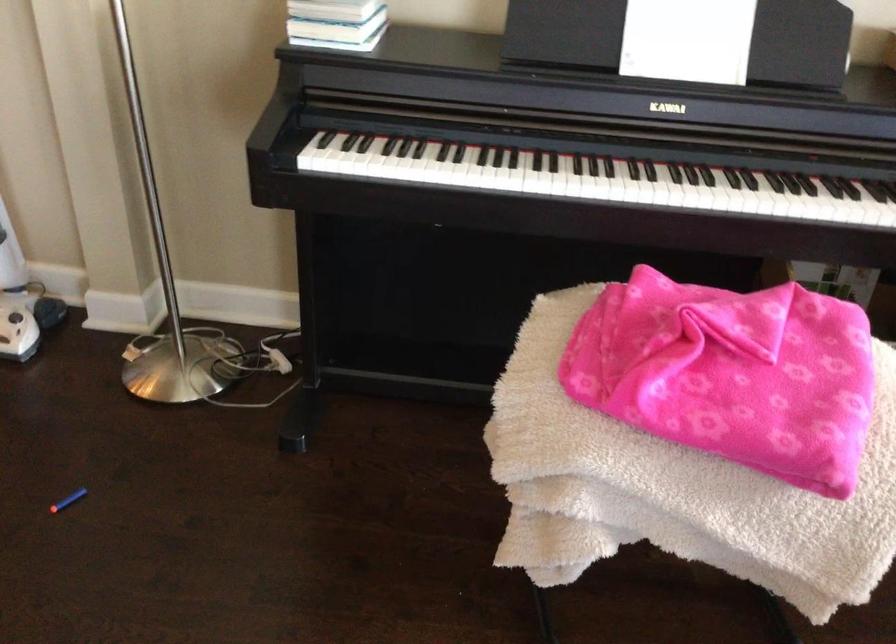
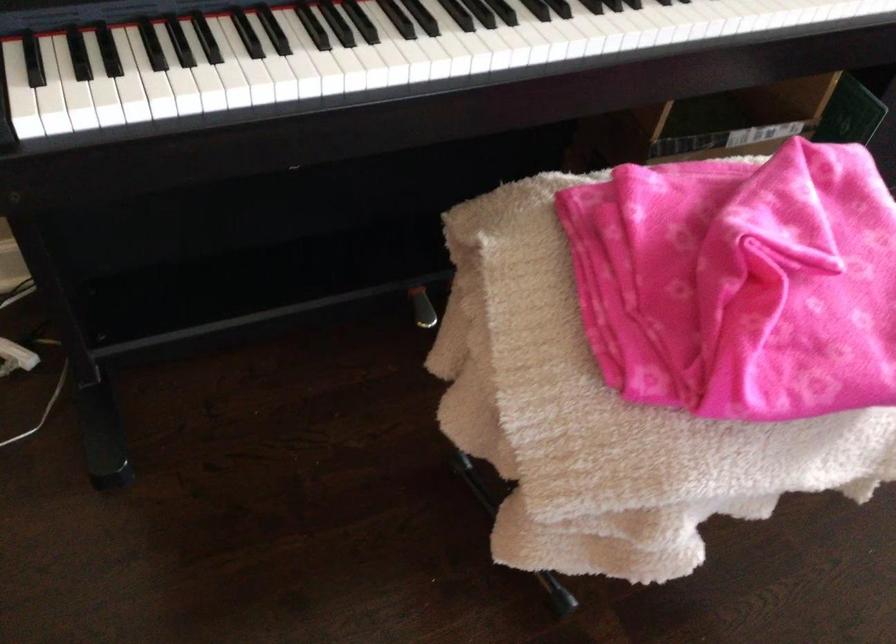
Find the pixel in the second image that matches (676,343) in the first image.

(739, 283)